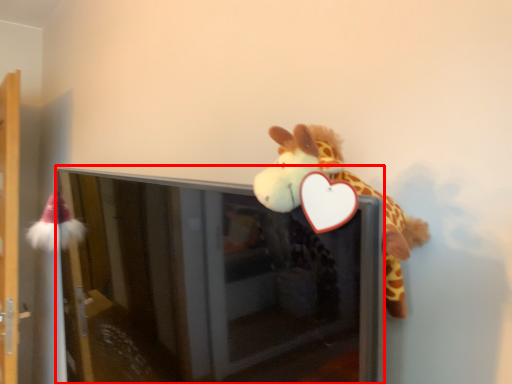
Question: From the image's perspective, considering the relative positions of screen door (annotated by the red box) and shelf in the image provided, where is screen door (annotated by the red box) located with respect to the staircase?

Choices:
 (A) above
 (B) below

Answer: (B)